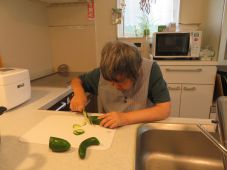
Locate instances of where you'd open the cabinet in the image. Your answer should be formatted as a list of tuples, i.e. [(x1, y1), (x2, y2), ...], where each tuple contains the x and y coordinates of a point satisfying the conditions above.

[(175, 89), (188, 89)]